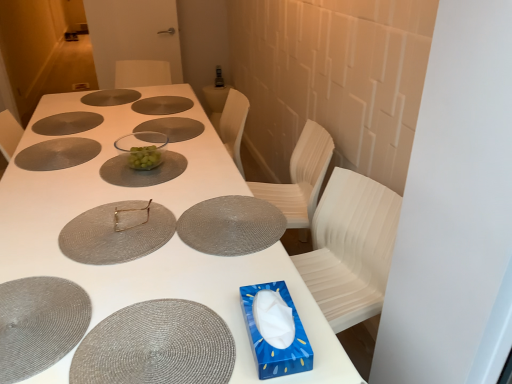
Find the location of a particular element. vacant space in between matte gray placemat at center, placed as the third glass plate when sorted from front to back, and transparent glass bowl at center, acting as the 6th glass plate starting from the front is located at coordinates (193, 161).